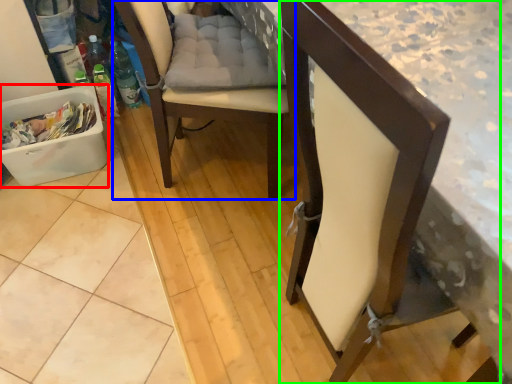
Question: Which is nearer to the laundry basket (highlighted by a red box)? chair (highlighted by a blue box) or chair (highlighted by a green box).

Choices:
 (A) chair
 (B) chair

Answer: (A)